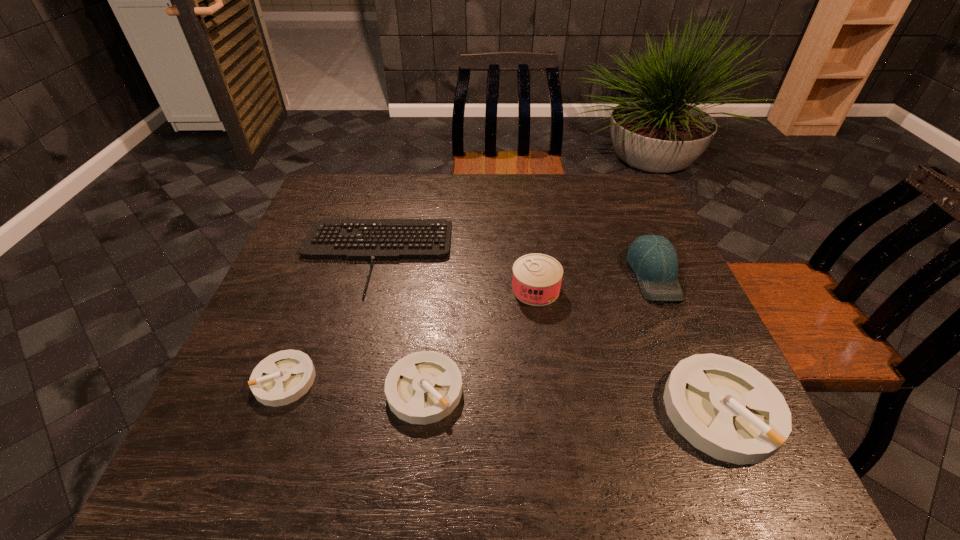
Locate an element on the screen. The height and width of the screenshot is (540, 960). free space located 0.110m on the left of the third shortest object is located at coordinates (331, 390).

The width and height of the screenshot is (960, 540). I want to click on vacant region located on the left of the tallest ashtray, so tap(639, 410).

Where is `vacant region located on the back of the shortest object`? The image size is (960, 540). vacant region located on the back of the shortest object is located at coordinates (389, 203).

Image resolution: width=960 pixels, height=540 pixels. What are the coordinates of `vacant space located 0.300m on the front of the baseball cap` in the screenshot? It's located at (717, 423).

Locate an element on the screen. vacant space located 0.370m on the left of the third object from right to left is located at coordinates (360, 289).

You are a GUI agent. You are given a task and a screenshot of the screen. Output one action in this format:
    pyautogui.click(x=<x>, y=<y>)
    Task: Click on the ashtray that is at the left edge
    The width and height of the screenshot is (960, 540).
    Given the screenshot: What is the action you would take?
    pyautogui.click(x=281, y=378)

At what (x,y) coordinates should I click in order to perform the action: click on computer keyboard that is at the left edge. Please return your answer as a coordinate pair (x, y). Looking at the image, I should click on (371, 240).

This screenshot has width=960, height=540. What are the coordinates of `ashtray located in the right edge section of the desktop` in the screenshot? It's located at (725, 408).

Locate an element on the screen. The width and height of the screenshot is (960, 540). baseball cap present at the right edge is located at coordinates (653, 258).

Identify the location of object that is at the near left corner. The height and width of the screenshot is (540, 960). (281, 378).